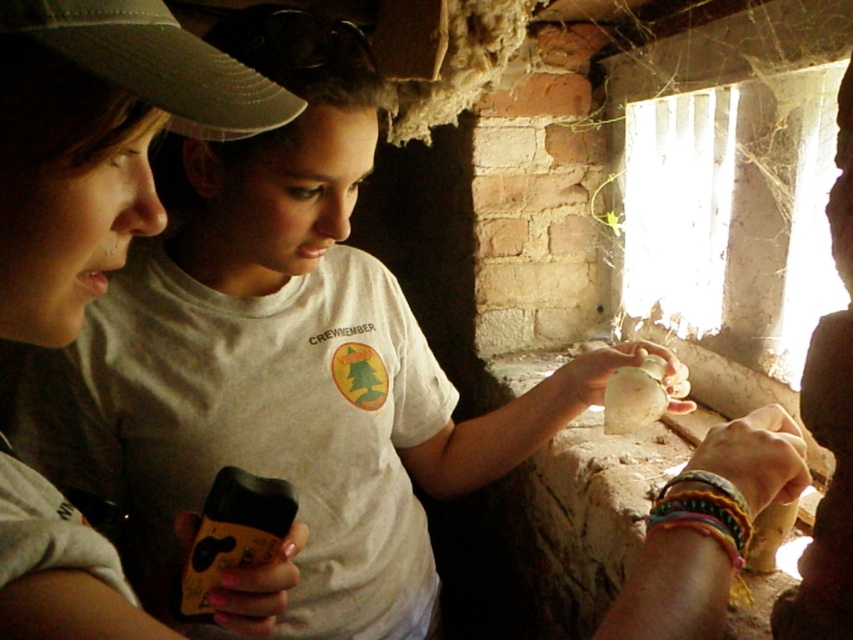
From the picture: You are trying to decide which item to place in a storage box that can only fit items smaller than the dark gray fabric baseball cap at upper left. Can the yellow matte smartphone at lower left fit in the box?

The dark gray fabric baseball cap at upper left is wider than the yellow matte smartphone at lower left. Since the storage box can only fit items smaller than the cap, the yellow matte smartphone at lower left can fit in the box because it is narrower than the cap.

Looking at this image, you are an observer in the scene. You notice the yellow matte smartphone at lower left and the translucent glass bottle at center. Which object is closer to the bottom of the image?

The yellow matte smartphone at lower left is positioned under the translucent glass bottle at center, so it is closer to the bottom of the image.

You are standing in the scene and want to hand a note to the person wearing the white matte shirt at center. Which object should you avoid stepping over to reach them without disturbing the yellow matte smartphone at lower left?

You should avoid stepping over the yellow matte smartphone at lower left, as it is positioned lower and farther from the viewer compared to the white matte shirt at center. Since the white matte shirt at center is closer to you, you can approach them directly without needing to step over the smartphone.